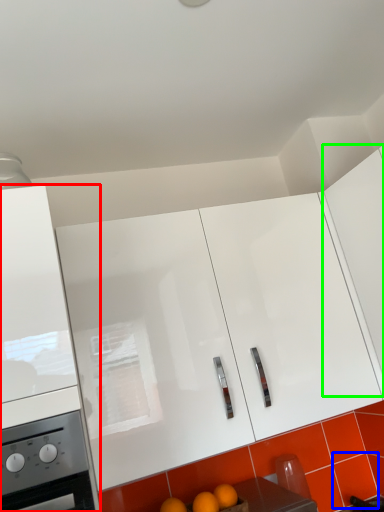
Question: Based on their relative distances, which object is farther from cabinetry (highlighted by a red box)? Choose from tile (highlighted by a blue box) and cabinetry (highlighted by a green box).

Choices:
 (A) tile
 (B) cabinetry

Answer: (A)